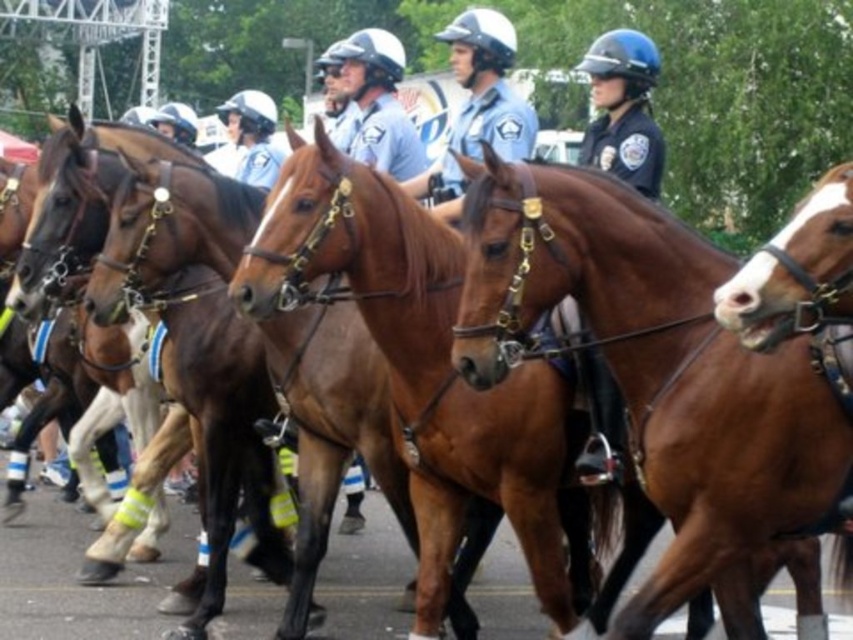
You are a photographer trying to capture a clear shot of the matte blue uniform at center and the glossy blue helmet at center. Since you want to focus on the uniform, which object should you adjust your camera to focus on first, considering their sizes?

The matte blue uniform at center is much taller than the glossy blue helmet at center, so you should focus on the matte blue uniform at center first as it is larger and more prominent.